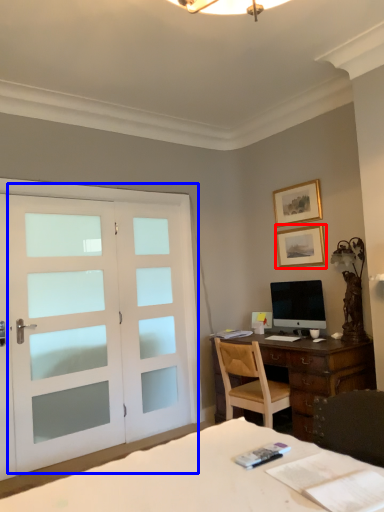
Question: Which object is further to the camera taking this photo, picture frame (highlighted by a red box) or door (highlighted by a blue box)?

Choices:
 (A) picture frame
 (B) door

Answer: (A)